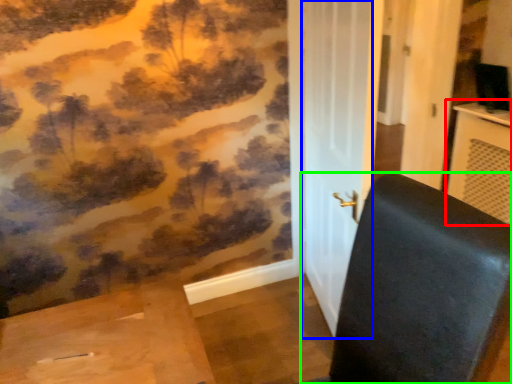
Question: Estimate the real-world distances between objects in this image. Which object is farther from table (highlighted by a red box), screen door (highlighted by a blue box) or furniture (highlighted by a green box)?

Choices:
 (A) screen door
 (B) furniture

Answer: (B)